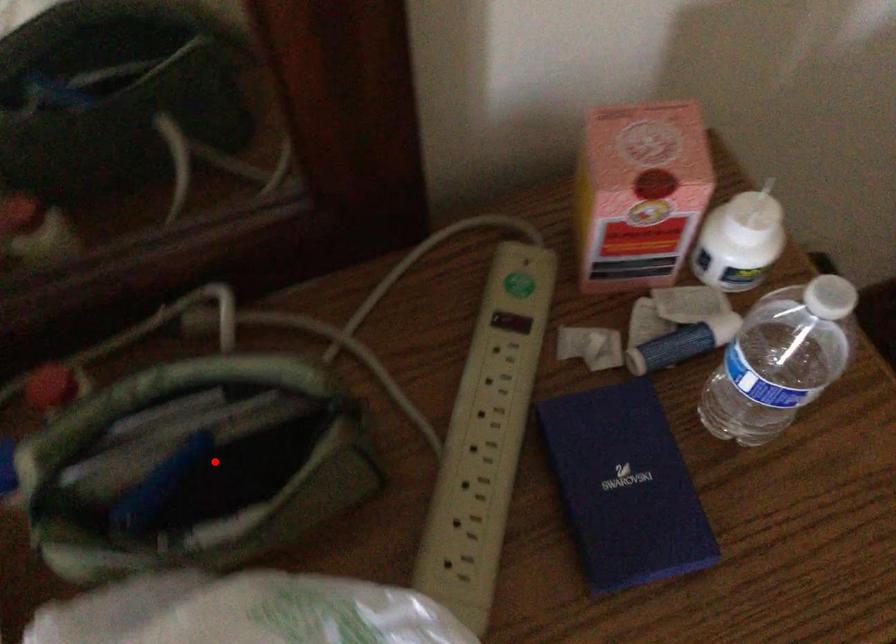
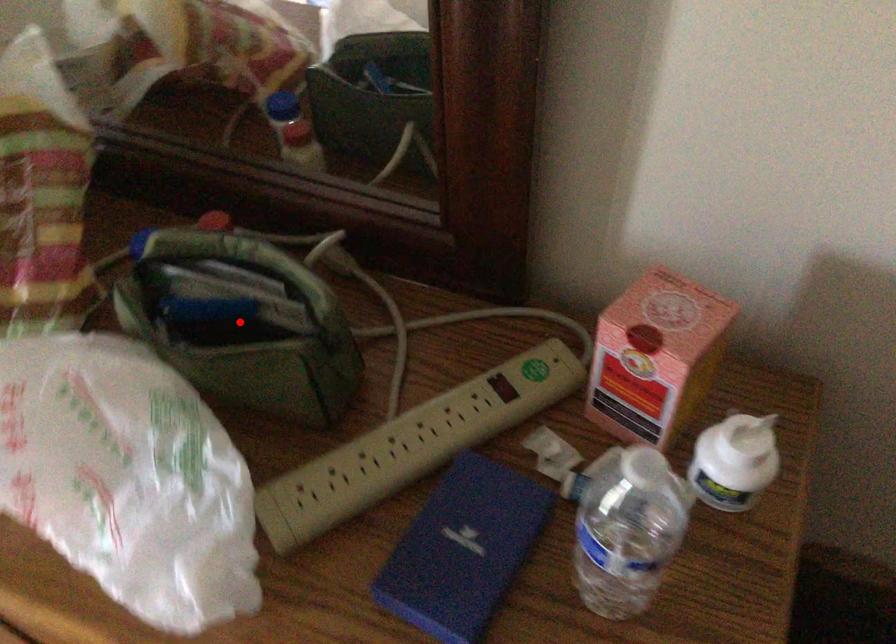
I am providing you with two images of the same scene from different viewpoints. A red point is marked on the first image and another point is marked on the second image. Is the red point in image1 aligned with the point shown in image2?

Yes